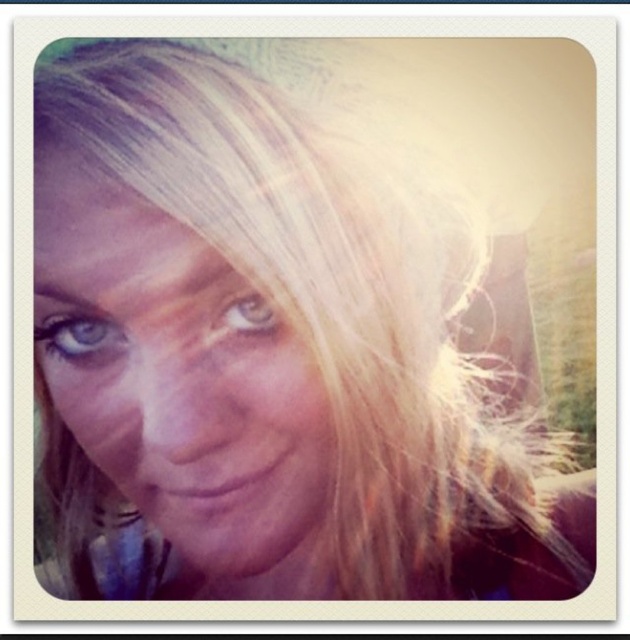
The width and height of the screenshot is (630, 640). Describe the element at coordinates (77, 337) in the screenshot. I see `blue matte eye at upper left` at that location.

Who is taller, blue matte eye at upper left or brown matte eye at center?

blue matte eye at upper left is taller.

Locate an element on the screen. blue matte eye at upper left is located at coordinates [77, 337].

Find the location of `blue matte eye at upper left`. blue matte eye at upper left is located at coordinates (77, 337).

Is point (307, 362) positioned before point (54, 337)?

Yes, point (307, 362) is in front of point (54, 337).

Does smooth skin face at center have a greater height compared to blue matte eye at upper left?

Correct, smooth skin face at center is much taller as blue matte eye at upper left.

You are a GUI agent. You are given a task and a screenshot of the screen. Output one action in this format:
    pyautogui.click(x=<x>, y=<y>)
    Task: Click on the smooth skin face at center
    
    Given the screenshot: What is the action you would take?
    pyautogui.click(x=178, y=376)

Does smooth skin face at center have a greater height compared to brown matte eye at center?

Indeed, smooth skin face at center has a greater height compared to brown matte eye at center.

In order to click on smooth skin face at center in this screenshot , I will do `click(178, 376)`.

Which is in front, point (229, 529) or point (256, 310)?

Positioned in front is point (256, 310).

This screenshot has height=640, width=630. I want to click on smooth skin face at center, so click(178, 376).